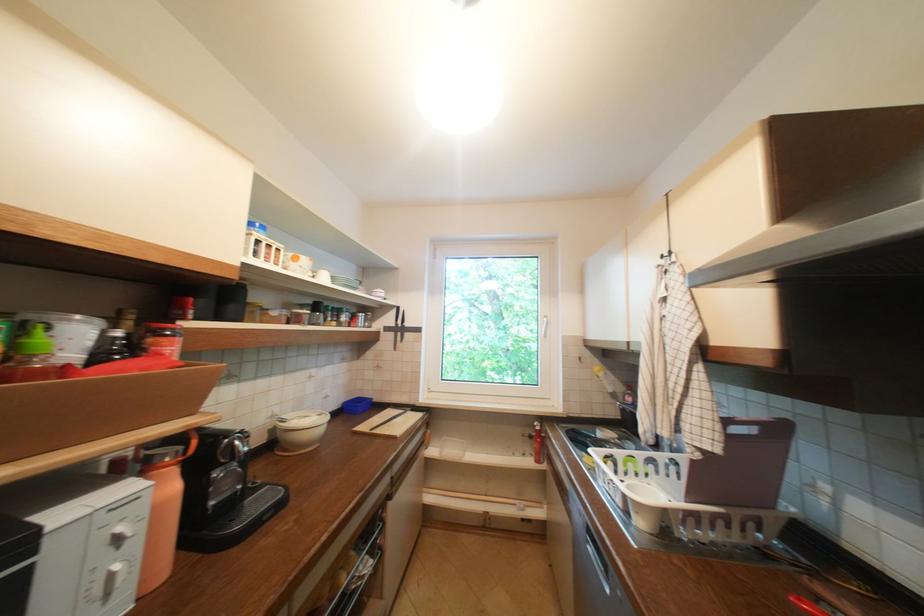
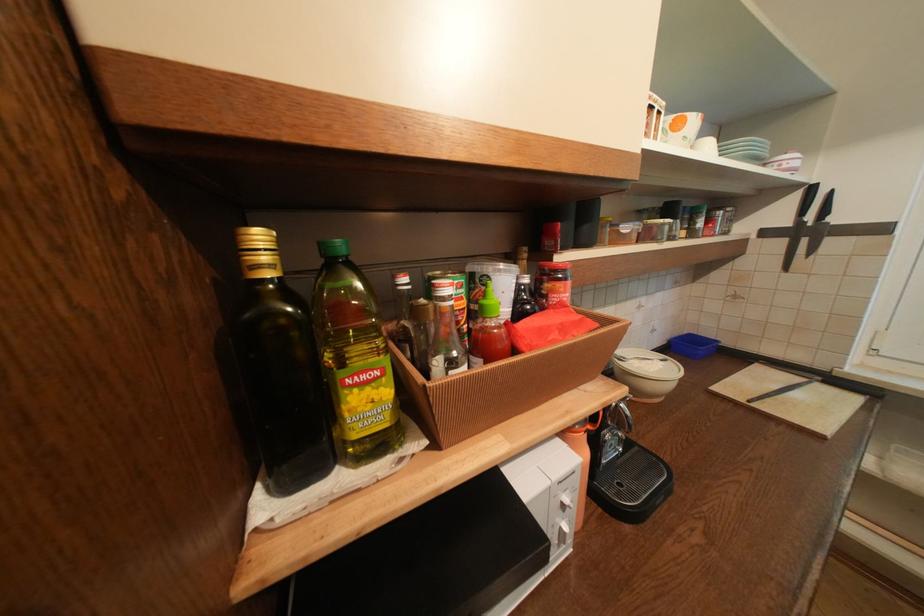
The point at (326,418) is marked in the first image. Where is the corresponding point in the second image?

(670, 363)